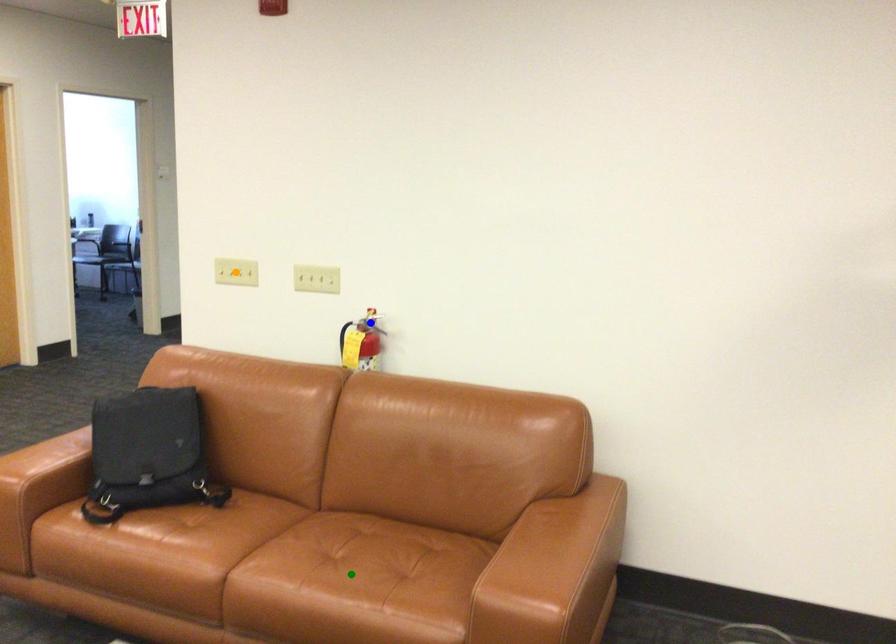
Order these from nearest to farthest:
1. green point
2. orange point
3. blue point

orange point, blue point, green point